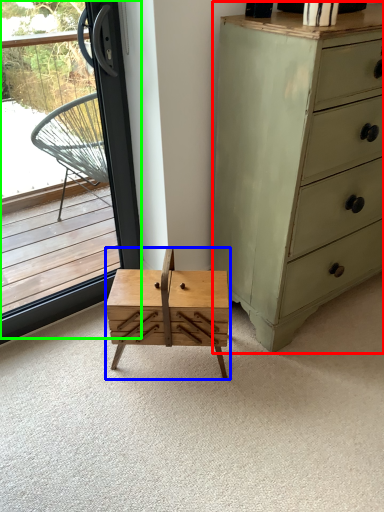
Question: Which object is positioned farthest from chest of drawers (highlighted by a red box)? Select from table (highlighted by a blue box) and window (highlighted by a green box).

Choices:
 (A) table
 (B) window

Answer: (B)